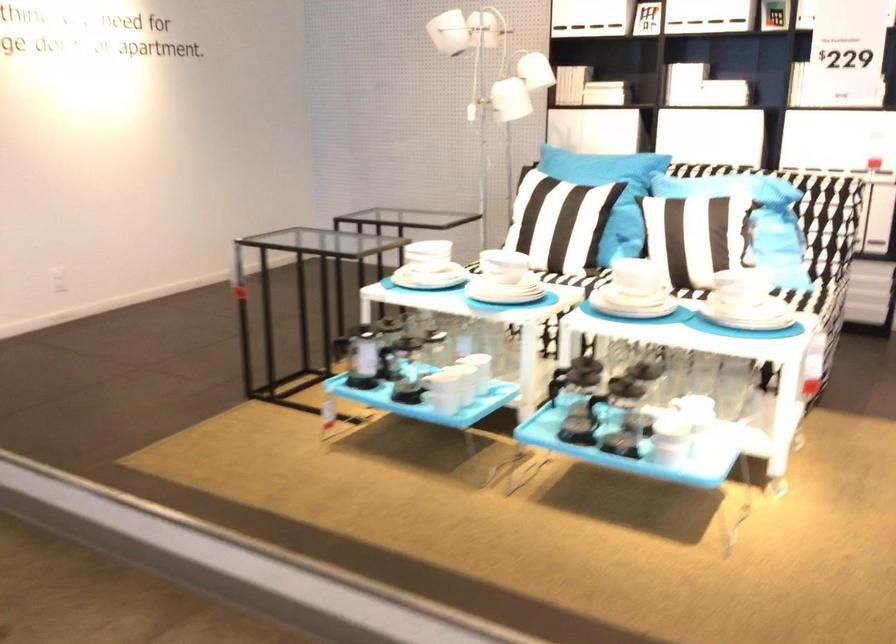
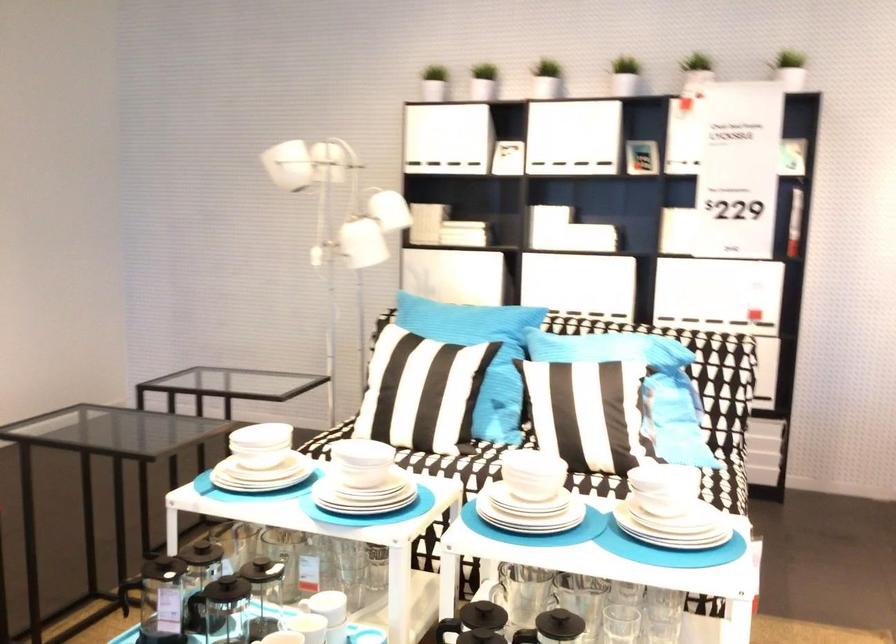
Question: The images are taken continuously from a first-person perspective. In which direction are you moving?

Choices:
 (A) Left
 (B) Right
 (C) Forward
 (D) Backward

Answer: (C)